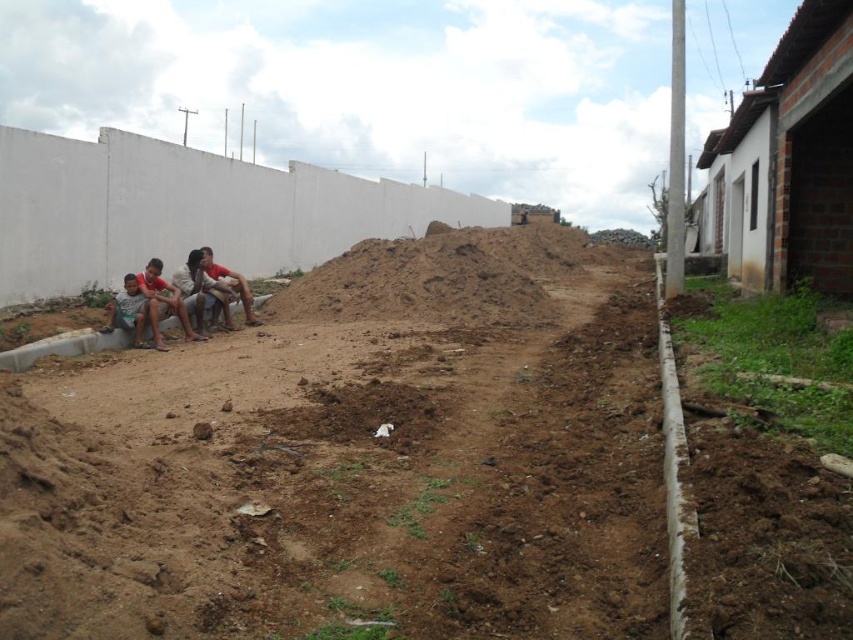
Measure the distance between light brown wooden bench at lower left and camera.

light brown wooden bench at lower left and camera are 9.37 meters apart.

Between light brown wooden bench at lower left and light brown skin at left, which one has more height?

Standing taller between the two is light brown wooden bench at lower left.

Is point (215, 280) positioned before point (148, 314)?

No, it is not.

Find the location of a particular element. light brown wooden bench at lower left is located at coordinates (190, 294).

Can you confirm if light brown skin at left is positioned above matte skin person at center left?

→ No, light brown skin at left is not above matte skin person at center left.

Does light brown skin at left have a lesser height compared to matte skin person at center left?

No.

Does point (151, 280) come closer to viewer compared to point (241, 292)?

Yes, point (151, 280) is closer to viewer.

Identify the location of light brown skin at left. Image resolution: width=853 pixels, height=640 pixels. (161, 301).

Between light brown wooden bench at lower left and matte skin person at center left, which one appears on the right side from the viewer's perspective?

matte skin person at center left is more to the right.

Can you confirm if light brown wooden bench at lower left is wider than matte skin person at center left?

Yes, light brown wooden bench at lower left is wider than matte skin person at center left.

Which is behind, point (229, 308) or point (212, 278)?

Point (212, 278)

Locate an element on the screen. light brown wooden bench at lower left is located at coordinates (190, 294).